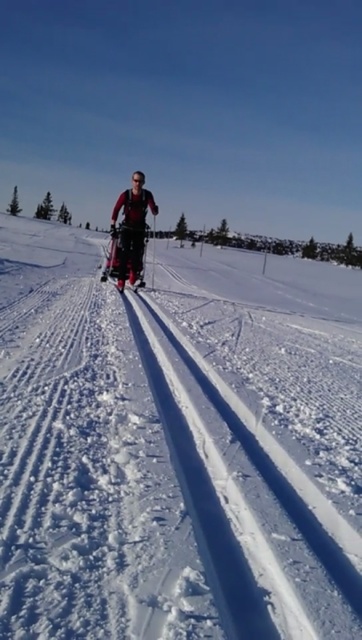
Question: Can you confirm if white smooth snow at center is thinner than matte black skisuit at center?

Choices:
 (A) yes
 (B) no

Answer: (B)

Question: Which of the following is the farthest from the observer?

Choices:
 (A) matte black skisuit at center
 (B) white smooth snow at center

Answer: (A)

Question: Does white smooth snow at center appear under matte black skisuit at center?

Choices:
 (A) yes
 (B) no

Answer: (A)

Question: Considering the relative positions of white smooth snow at center and matte black skisuit at center in the image provided, where is white smooth snow at center located with respect to matte black skisuit at center?

Choices:
 (A) below
 (B) above

Answer: (A)